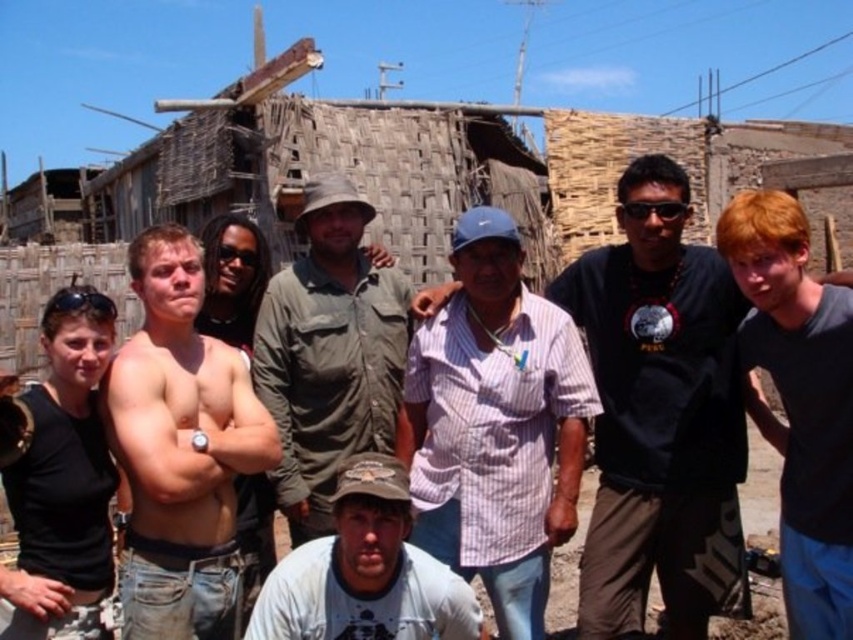
Can you confirm if pink striped shirt at center is taller than green canvas shirt at center?

Yes.

This screenshot has width=853, height=640. In order to click on pink striped shirt at center in this screenshot , I will do `click(496, 424)`.

This screenshot has width=853, height=640. Identify the location of pink striped shirt at center. (496, 424).

Between pink striped shirt at center and black matte tank top at left, which one has less height?

With less height is black matte tank top at left.

Does pink striped shirt at center have a greater width compared to black matte tank top at left?

Correct, the width of pink striped shirt at center exceeds that of black matte tank top at left.

Is point (585, 378) closer to camera compared to point (38, 563)?

No, (585, 378) is further to viewer.

The width and height of the screenshot is (853, 640). What are the coordinates of `pink striped shirt at center` in the screenshot? It's located at (496, 424).

Can you confirm if striped cotton shirt at center is smaller than dark blue t-shirt at right?

No.

In the scene shown: Which is above, striped cotton shirt at center or dark blue t-shirt at right?

striped cotton shirt at center

Does point (670, 412) lie behind point (751, 321)?

Yes.

The image size is (853, 640). Find the location of `striped cotton shirt at center`. striped cotton shirt at center is located at coordinates (659, 413).